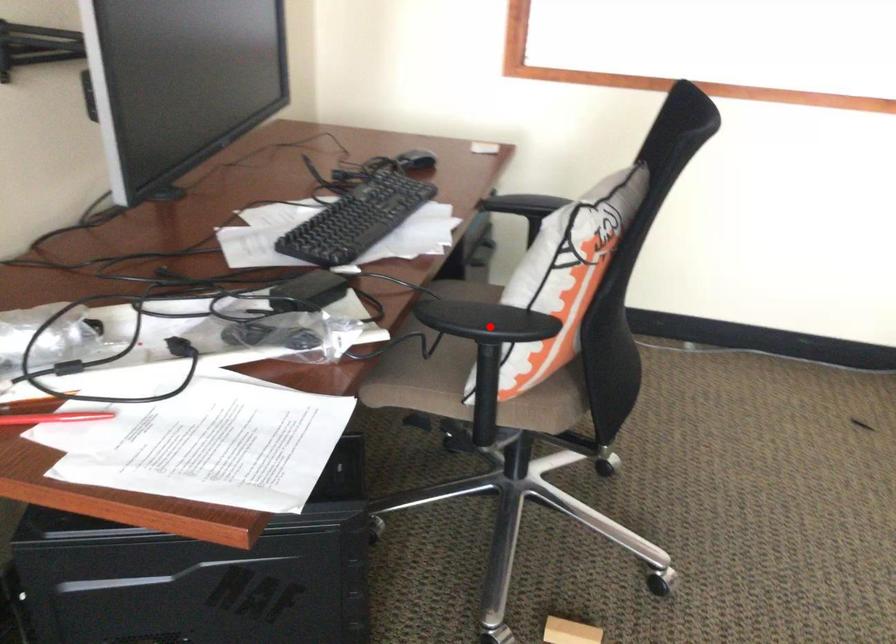
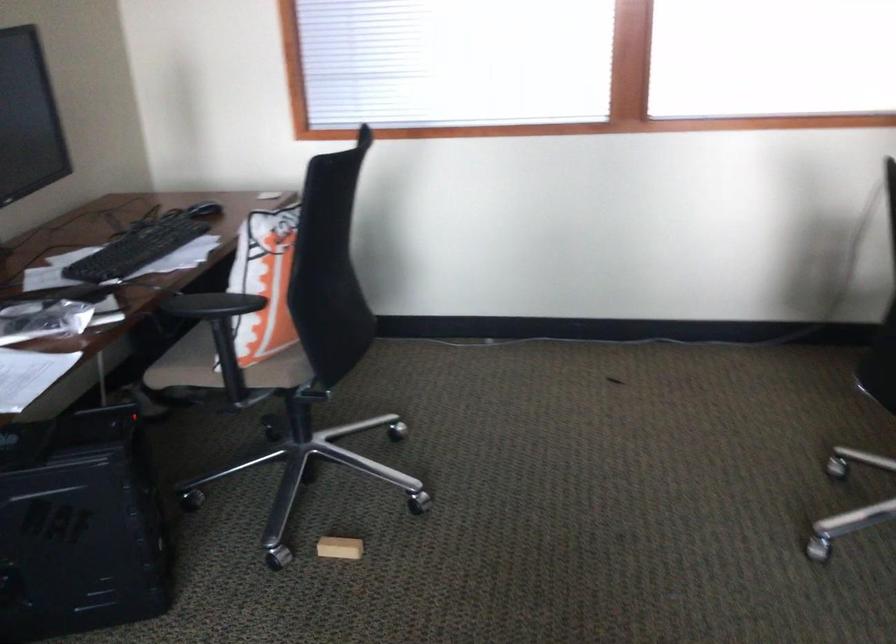
Question: I am providing you with two images of the same scene from different viewpoints. In image1, a red point is highlighted. Considering the same 3D point in image2, which of the following is correct?

Choices:
 (A) It is closer
 (B) It is farther

Answer: (B)